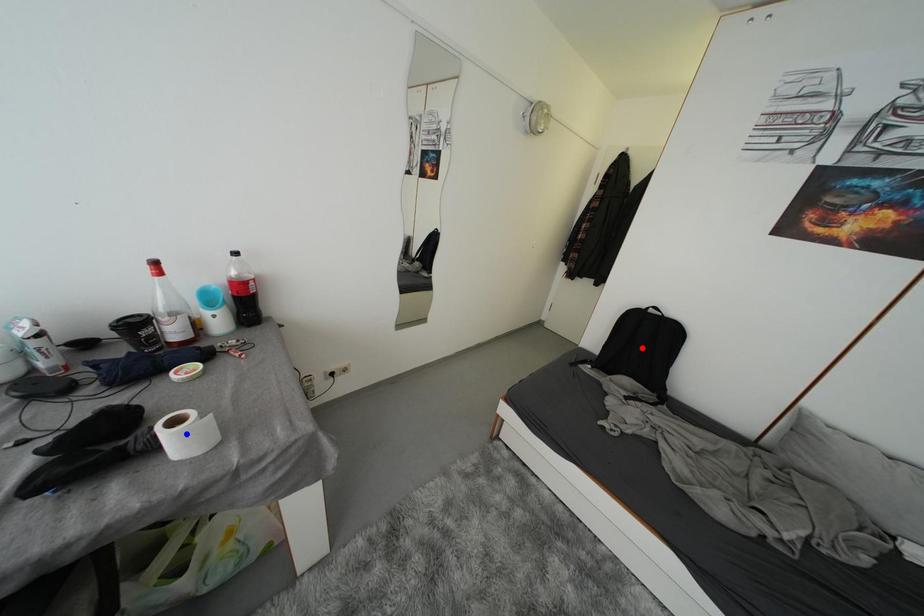
Question: Two points are marked on the image. Which point is closer to the camera?

Choices:
 (A) Blue point is closer.
 (B) Red point is closer.

Answer: (A)